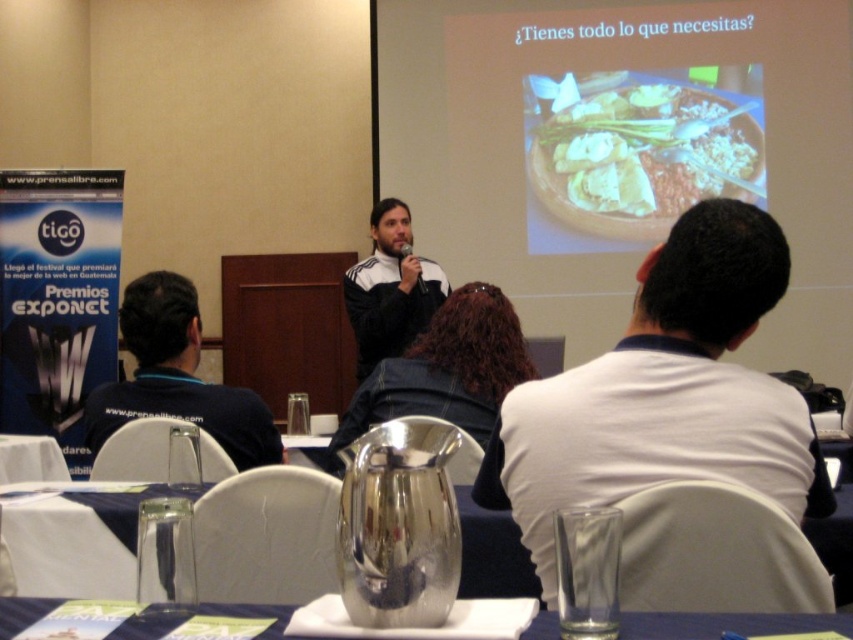
Is brown matte plate at upper center thinner than metallic silver pitcher at center?

In fact, brown matte plate at upper center might be wider than metallic silver pitcher at center.

At what (x,y) coordinates should I click in order to perform the action: click on brown matte plate at upper center. Please return your answer as a coordinate pair (x, y). This screenshot has width=853, height=640. Looking at the image, I should click on (637, 148).

Is brown matte plate at upper center closer to the viewer compared to metallic silver pitcher at lower center?

No.

Which is behind, point (543, 140) or point (517, 560)?

The point (543, 140) is more distant.

Where is `brown matte plate at upper center`? The width and height of the screenshot is (853, 640). brown matte plate at upper center is located at coordinates (x=637, y=148).

Can you confirm if white cotton shirt at upper right is smaller than dark blue shirt at left?

No, white cotton shirt at upper right is not smaller than dark blue shirt at left.

Which is in front, point (508, 412) or point (236, 448)?

Point (508, 412) is more forward.

Who is more distant from viewer, (653, 288) or (97, 397)?

The point (97, 397) is behind.

Find the location of a particular element. The width and height of the screenshot is (853, 640). white cotton shirt at upper right is located at coordinates (664, 394).